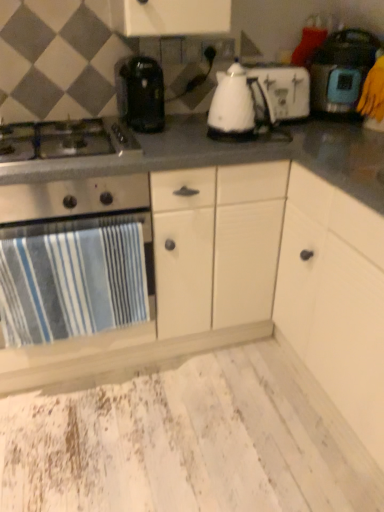
Question: Visually, is white plastic toaster at center, which is the 2th kitchen appliance in left-to-right order, positioned to the left or to the right of stainless steel gas stove at left?

Choices:
 (A) right
 (B) left

Answer: (A)

Question: In terms of width, does white plastic toaster at center, which is the 2th kitchen appliance in left-to-right order, look wider or thinner when compared to stainless steel gas stove at left?

Choices:
 (A) thin
 (B) wide

Answer: (A)

Question: Considering the real-world distances, which object is closest to the blue striped towel at left, the 1th kitchen appliance positioned from the left?

Choices:
 (A) stainless steel gas stove at left
 (B) gray matte countertop at center
 (C) matte black rice cooker at right, the 1th kitchen appliance in the right-to-left sequence
 (D) white plastic toaster at center, arranged as the 2th kitchen appliance when viewed from the right

Answer: (A)

Question: Based on their relative distances, which object is farther from the gray matte countertop at center?

Choices:
 (A) stainless steel gas stove at left
 (B) blue striped towel at left, the 1th kitchen appliance positioned from the left
 (C) white plastic toaster at center, which is the 2th kitchen appliance in left-to-right order
 (D) matte black rice cooker at right, the 1th kitchen appliance in the right-to-left sequence

Answer: (D)